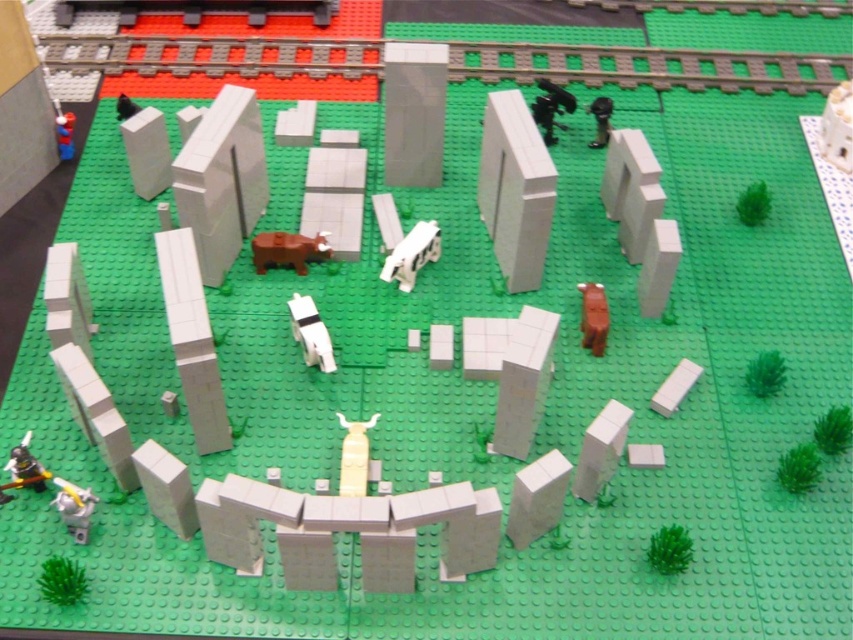
You are a toy collector who wants to display both the brown matte horse at center and the black plastic cow at upper center on a shelf. Based on their sizes, which one should you place on the lower shelf to avoid blocking the view of the smaller one?

The brown matte horse at center is not as tall as the black plastic cow at upper center, so you should place the brown matte horse at center on the lower shelf to ensure the taller black plastic cow at upper center is visible above it.

You are designing a new LEGO set and need to ensure that all elements fit within the provided base. The base has a maximum width capacity of 20 cm. Given the white matte rectangular block at center and the black plastic cow at upper right, which of these two LEGO pieces can potentially exceed the base width limit?

The white matte rectangular block at center has a larger width than the black plastic cow at upper right, so it is possible that the white matte rectangular block at center could exceed the 20 cm width limit if its dimensions are not carefully measured.